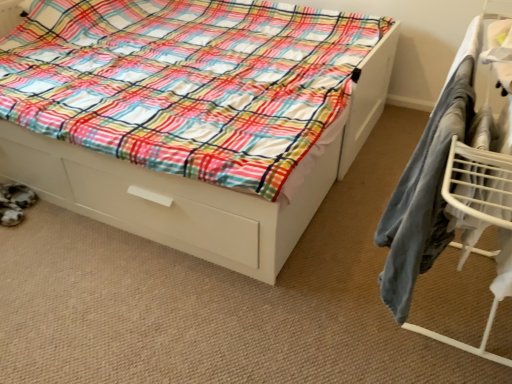
Question: In terms of width, does metal drying rack at right look wider or thinner when compared to white glossy bed at center?

Choices:
 (A) thin
 (B) wide

Answer: (A)

Question: Looking at the image, does metal drying rack at right seem bigger or smaller compared to white glossy bed at center?

Choices:
 (A) big
 (B) small

Answer: (B)

Question: Based on their positions, is metal drying rack at right located to the left or right of white glossy bed at center?

Choices:
 (A) left
 (B) right

Answer: (B)

Question: Is white glossy bed at center inside the boundaries of metal drying rack at right, or outside?

Choices:
 (A) inside
 (B) outside

Answer: (B)

Question: In the image, is white glossy bed at center positioned in front of or behind metal drying rack at right?

Choices:
 (A) behind
 (B) front

Answer: (A)

Question: Would you say white glossy bed at center is to the left or to the right of metal drying rack at right in the picture?

Choices:
 (A) right
 (B) left

Answer: (B)

Question: From their relative heights in the image, would you say white glossy bed at center is taller or shorter than metal drying rack at right?

Choices:
 (A) tall
 (B) short

Answer: (B)